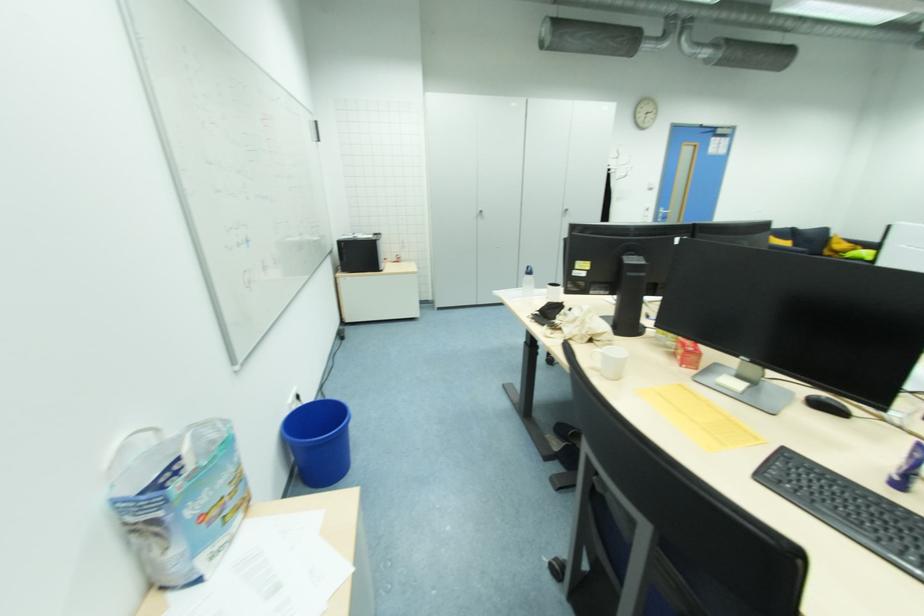
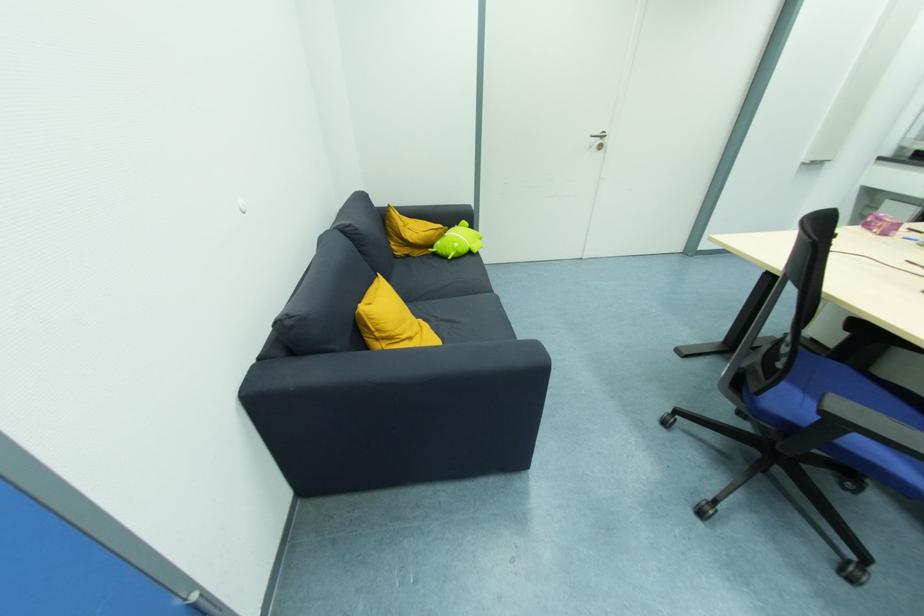
Find the pixel in the second image that matches point (845, 254) in the first image.

(435, 248)